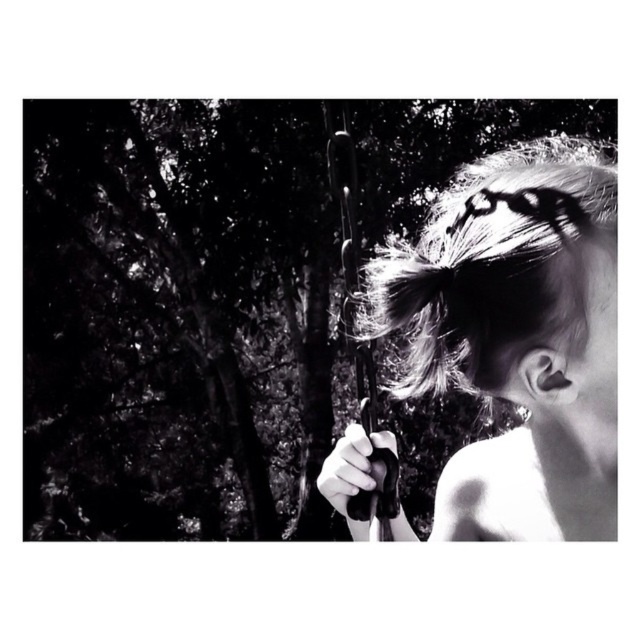
You are a photographer trying to capture the scene from the same angle. You notice the dark textured tree at upper left and the shiny black hair at right. Which object should you focus on first if you want to ensure both are in the frame without moving the camera?

The dark textured tree at upper left should be focused on first since it is positioned to the left of the shiny black hair at right, ensuring that both remain within the frame when starting from the left side.

You are a photographer analyzing the composition of this image. You notice the dark textured tree at upper left and the shiny black hair at right. Which object is placed higher in the frame?

The dark textured tree at upper left is positioned over shiny black hair at right, meaning it is higher in the frame.